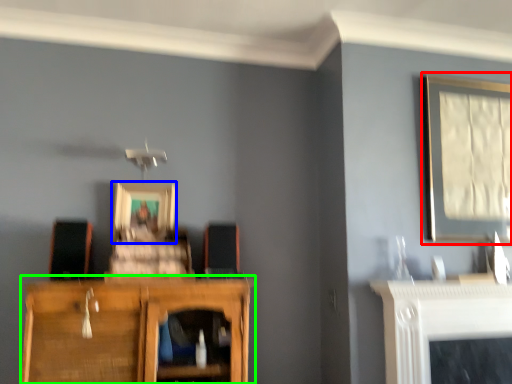
Question: Which object is the closest to the picture frame (highlighted by a red box)? Choose among these: picture frame (highlighted by a blue box) or cupboard (highlighted by a green box).

Choices:
 (A) picture frame
 (B) cupboard

Answer: (B)